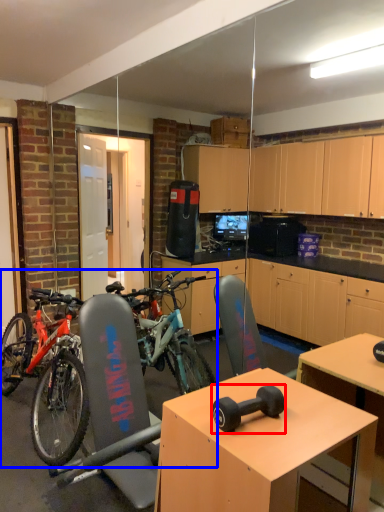
Question: Among these objects, which one is nearest to the camera, dumbbell (highlighted by a red box) or bicycle (highlighted by a blue box)?

Choices:
 (A) dumbbell
 (B) bicycle

Answer: (A)